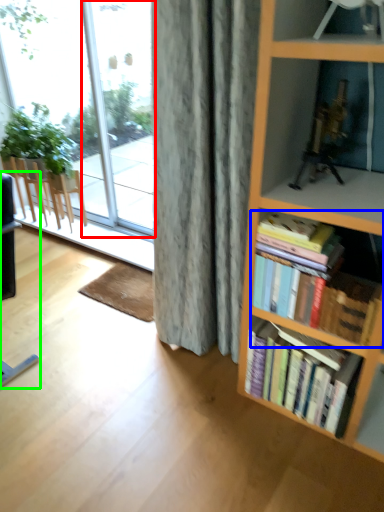
Question: Considering the real-world distances, which object is closest to glass door (highlighted by a red box)? book (highlighted by a blue box) or chair (highlighted by a green box).

Choices:
 (A) book
 (B) chair

Answer: (B)